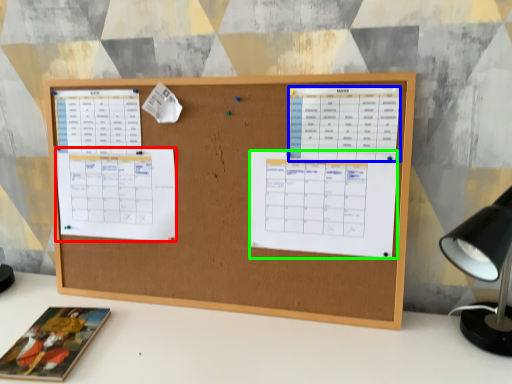
Question: Which object is positioned farthest from list (highlighted by a red box)? Select from list (highlighted by a blue box) and list (highlighted by a green box).

Choices:
 (A) list
 (B) list

Answer: (A)